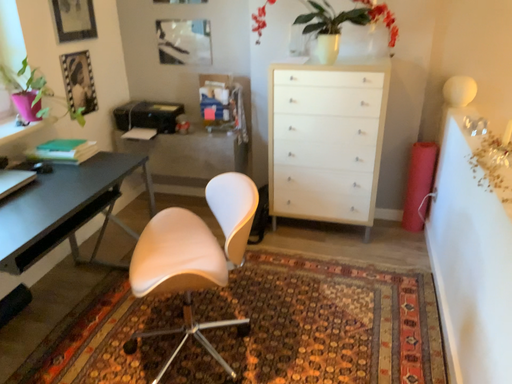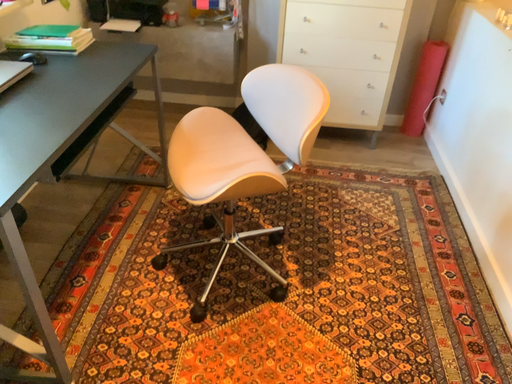
Question: How did the camera likely rotate when shooting the video?

Choices:
 (A) rotated upward
 (B) rotated downward

Answer: (B)